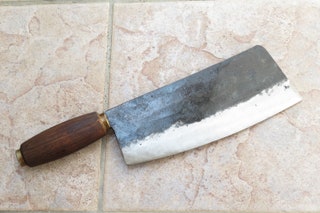
Image resolution: width=320 pixels, height=213 pixels. I want to click on grout, so click(x=107, y=58), click(x=38, y=3).